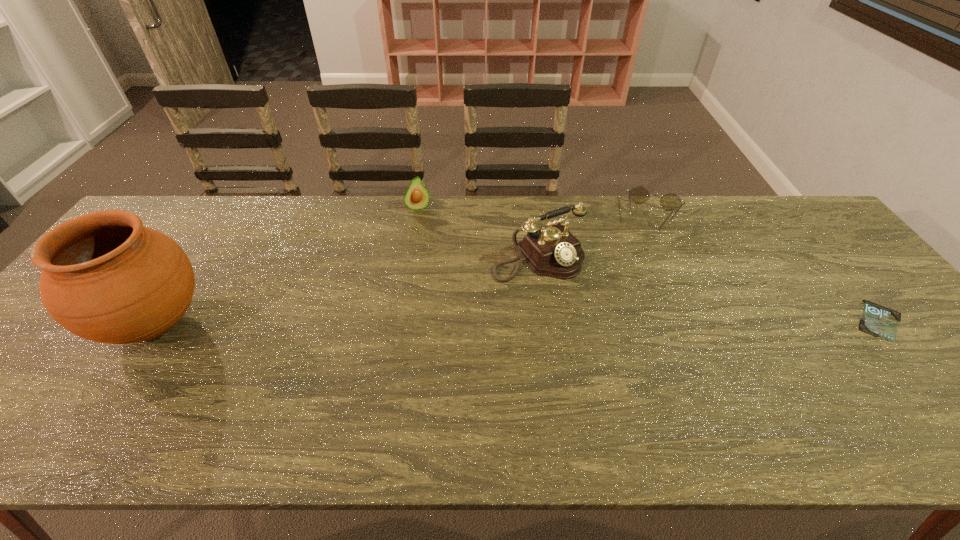
Find the location of a particular element. vacant space located 0.060m on the back of the tallest object is located at coordinates (192, 269).

Identify the location of vacant space situated 0.350m on the left of the shortest object. This screenshot has height=540, width=960. (712, 320).

At what (x,y) coordinates should I click in order to perform the action: click on free space located 0.100m on the cut side of the third shortest object. Please return your answer as a coordinate pair (x, y). This screenshot has width=960, height=540. Looking at the image, I should click on (427, 231).

Where is `blank space located on the cut side of the third shortest object`? The image size is (960, 540). blank space located on the cut side of the third shortest object is located at coordinates (429, 237).

At what (x,y) coordinates should I click in order to perform the action: click on vacant position located 0.200m on the cut side of the third shortest object. Please return your answer as a coordinate pair (x, y). The height and width of the screenshot is (540, 960). Looking at the image, I should click on (435, 252).

Locate an element on the screen. This screenshot has height=540, width=960. vacant area situated 0.240m on the dial of the fourth shortest object is located at coordinates (621, 343).

The height and width of the screenshot is (540, 960). In order to click on free space located 0.330m on the dial of the fourth shortest object in this screenshot , I will do (647, 372).

Identify the location of blank space located on the dial of the fourth shortest object. The width and height of the screenshot is (960, 540). (627, 349).

Image resolution: width=960 pixels, height=540 pixels. In order to click on free location located on the front-facing side of the second object from right to left in this screenshot , I will do (629, 305).

Locate an element on the screen. The image size is (960, 540). free space located 0.080m on the front-facing side of the second object from right to left is located at coordinates (644, 247).